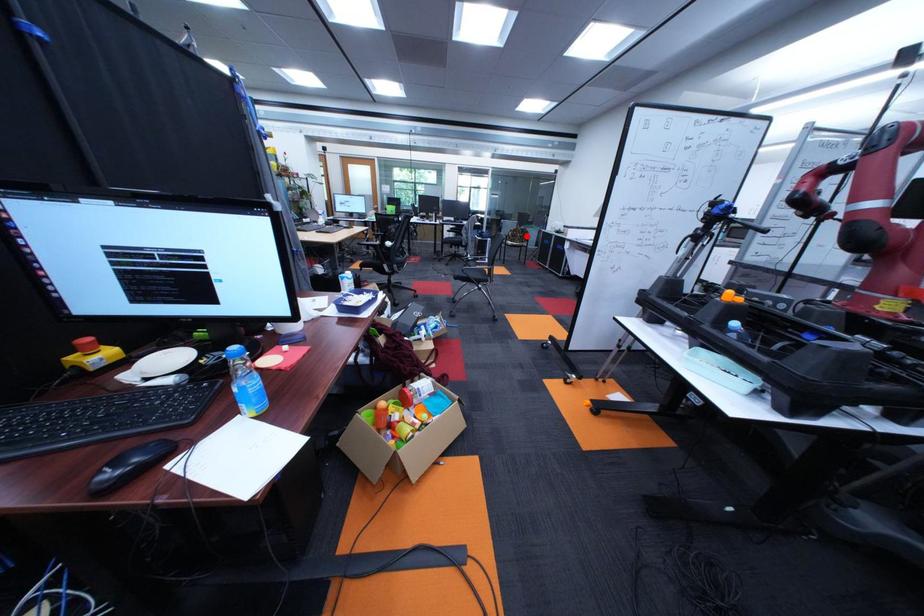
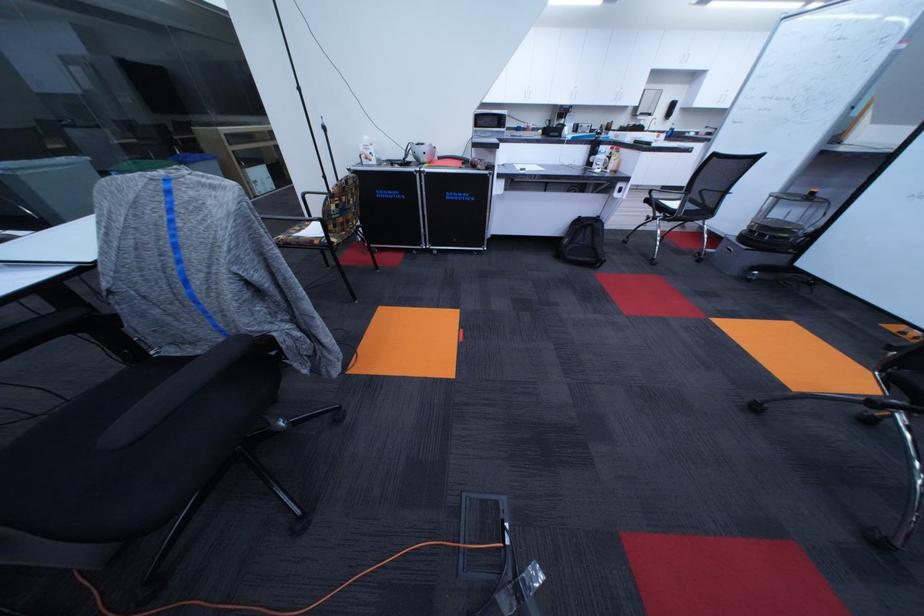
In the second image, find the point that corresponds to the highlighted location in the first image.

(356, 209)